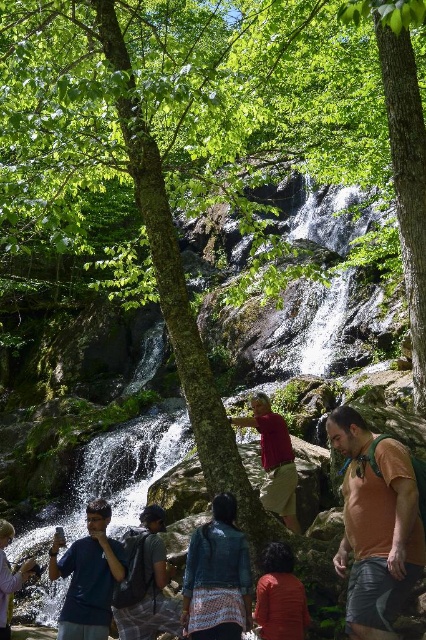
You are a photographer positioned at the origin point of the image. You want to capture a photo of the blue textured jacket at center. What are the coordinates of the jacket?

The coordinates of the blue textured jacket at center are at point (x=218, y=577).

Based on the photo, you are a photographer standing at the edge of the waterfall. You want to take a photo that includes both the blue textured jacket at center and the matte red shirt at center. What is the minimum distance you need to move backward to ensure both subjects are in frame?

The blue textured jacket at center and matte red shirt at center are 7.27 meters apart from each other. To include both in the frame, you need to move backward until the camera can capture a field of view that spans at least 7.27 meters between them.

You are a photographer trying to capture a photo of the waterfall. You have a blue textured jacket at center and a matte black phone at lower left in your shot. Which object in the frame takes up more horizontal space?

The blue textured jacket at center takes up more horizontal space than the matte black phone at lower left because its width is larger.